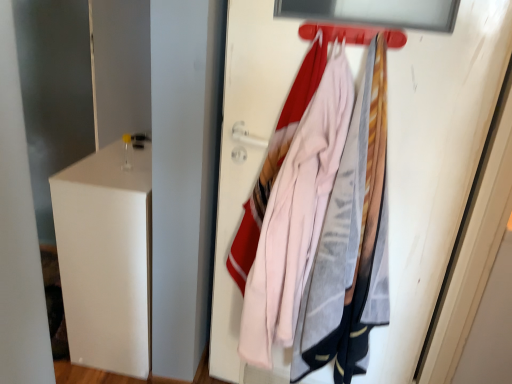
Question: Is metallic red hanger at upper center bigger or smaller than pink fabric coat at center?

Choices:
 (A) big
 (B) small

Answer: (B)

Question: Would you say metallic red hanger at upper center is inside or outside pink fabric coat at center?

Choices:
 (A) inside
 (B) outside

Answer: (B)

Question: Based on their relative distances, which object is nearer to the pink fabric at upper right?

Choices:
 (A) white matte file cabinet at left
 (B) pink fabric coat at center
 (C) metallic red hanger at upper center

Answer: (B)

Question: Which is farther from the pink fabric at upper right?

Choices:
 (A) white matte file cabinet at left
 (B) metallic red hanger at upper center
 (C) pink fabric coat at center

Answer: (A)